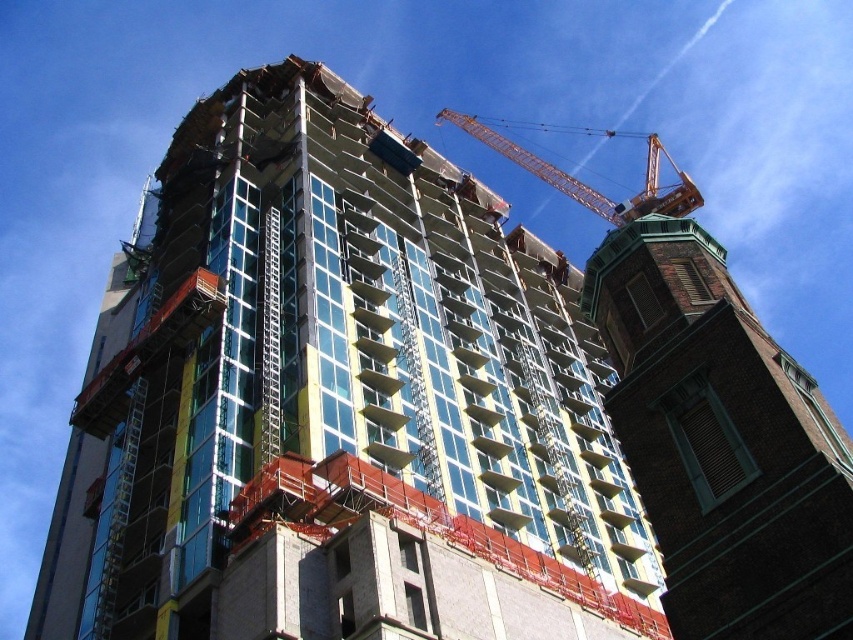
Question: Considering the real-world distances, which object is farthest from the brown brick tower at right?

Choices:
 (A) orange metallic crane at upper center
 (B) glassy concrete building at center

Answer: (A)

Question: Does brown brick tower at right lie behind orange metallic crane at upper center?

Choices:
 (A) yes
 (B) no

Answer: (B)

Question: Is glassy concrete building at center bigger than orange metallic crane at upper center?

Choices:
 (A) yes
 (B) no

Answer: (B)

Question: Is the position of glassy concrete building at center more distant than that of brown brick tower at right?

Choices:
 (A) yes
 (B) no

Answer: (A)

Question: Which of the following is the farthest from the observer?

Choices:
 (A) glassy concrete building at center
 (B) brown brick tower at right
 (C) orange metallic crane at upper center

Answer: (C)

Question: Which of the following is the closest to the observer?

Choices:
 (A) glassy concrete building at center
 (B) orange metallic crane at upper center
 (C) brown brick tower at right

Answer: (C)